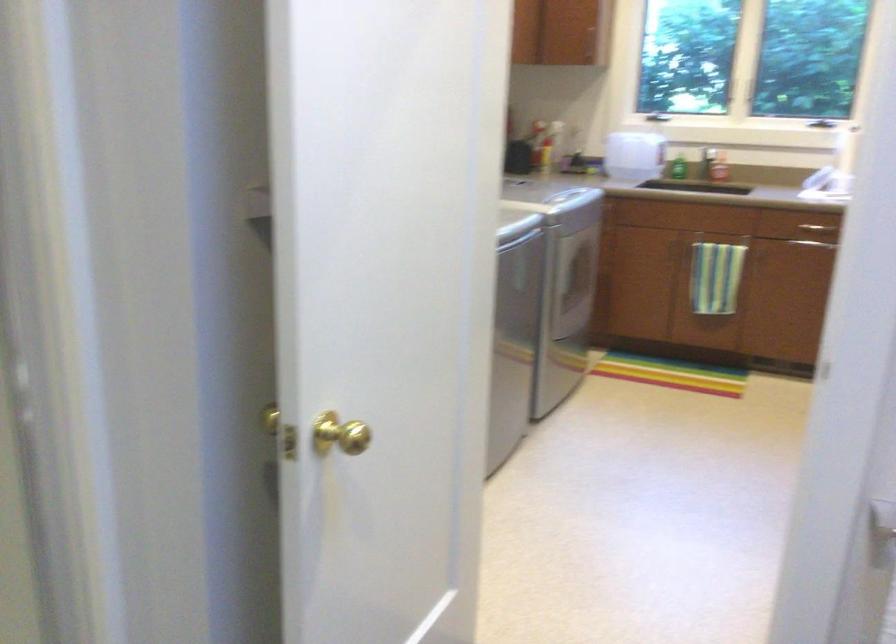
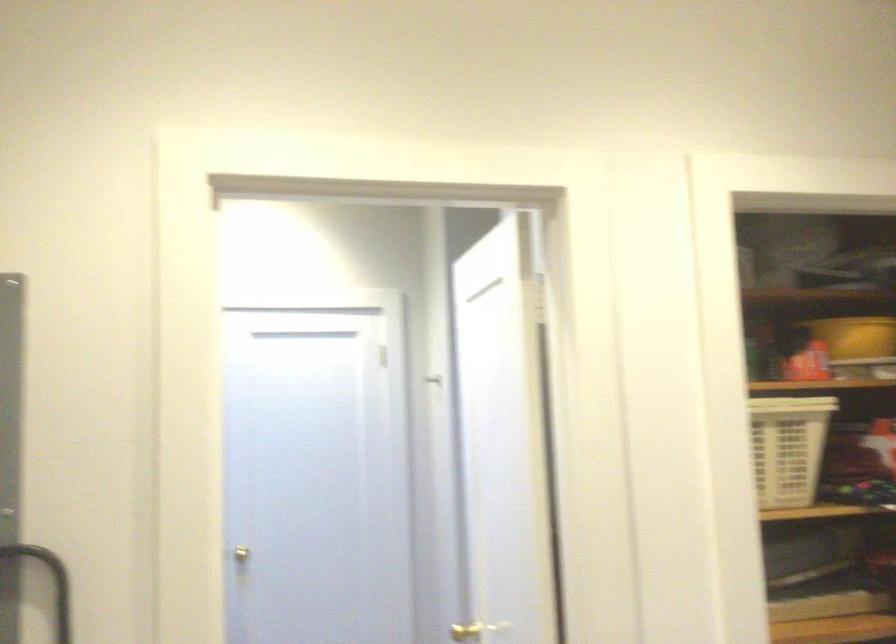
The point at (288, 456) is marked in the first image. Where is the corresponding point in the second image?

(464, 632)